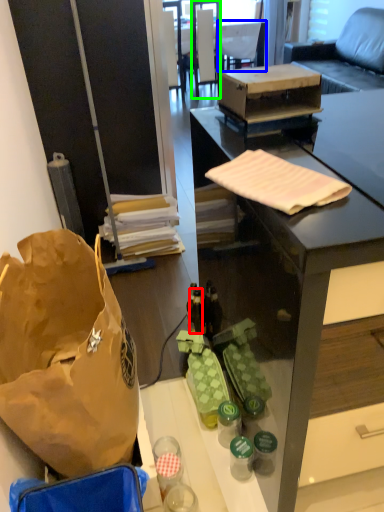
Question: Based on their relative distances, which object is nearer to bottle (highlighted by a red box)? Choose from armchair (highlighted by a blue box) and chair (highlighted by a green box).

Choices:
 (A) armchair
 (B) chair

Answer: (B)